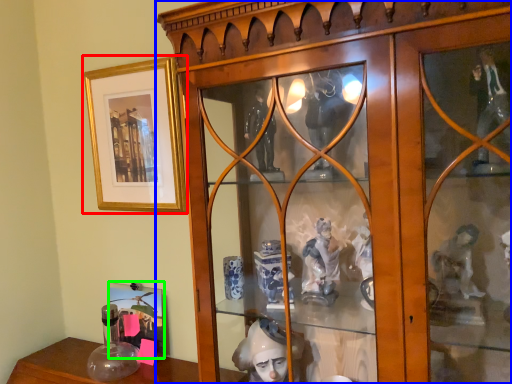
Question: Which object is the closest to the picture frame (highlighted by a red box)? Choose among these: furniture (highlighted by a blue box) or picture frame (highlighted by a green box).

Choices:
 (A) furniture
 (B) picture frame

Answer: (A)